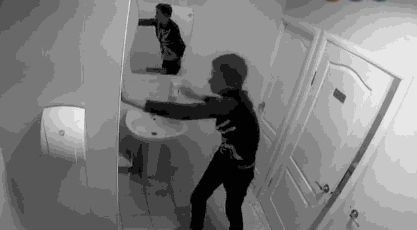
The image size is (417, 230). Identify the location of door. (311, 138), (281, 86).